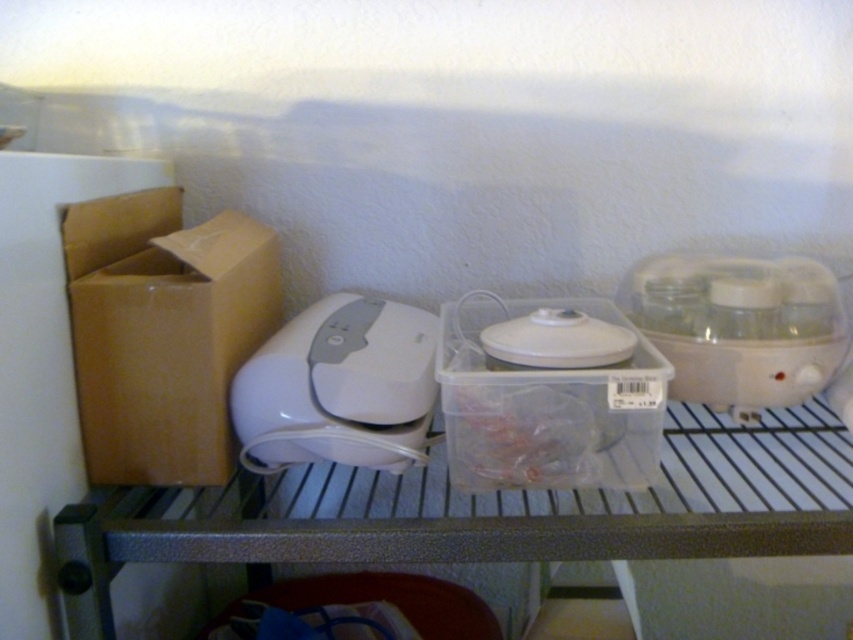
Who is more distant from viewer, (509,307) or (695,387)?

Point (509,307)

Between transparent plastic container at center and white plastic food processor at right, which one appears on the right side from the viewer's perspective?

white plastic food processor at right

Is point (630, 390) positioned in front of point (723, 388)?

That is True.

Find the location of `transparent plastic container at center`. transparent plastic container at center is located at coordinates (547, 403).

Can you confirm if brown cardboard box at left is positioned to the right of white plastic appliance at center?

In fact, brown cardboard box at left is to the left of white plastic appliance at center.

This screenshot has width=853, height=640. What are the coordinates of `brown cardboard box at left` in the screenshot? It's located at (163, 332).

Which of these two, transparent plastic container at center or white plastic appliance at center, stands taller?

With more height is transparent plastic container at center.

Does transparent plastic container at center lie behind white plastic appliance at center?

No, transparent plastic container at center is in front of white plastic appliance at center.

Image resolution: width=853 pixels, height=640 pixels. I want to click on transparent plastic container at center, so tap(547, 403).